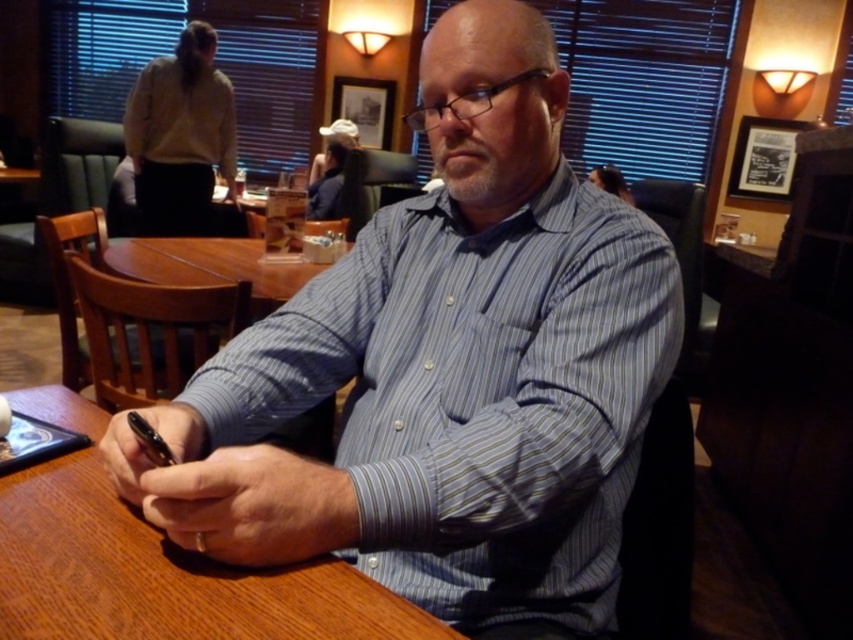
Question: Considering the relative positions of blue striped shirt at center and wooden table at center in the image provided, where is blue striped shirt at center located with respect to wooden table at center?

Choices:
 (A) left
 (B) right

Answer: (B)

Question: Which point is closer to the camera taking this photo?

Choices:
 (A) (480, 12)
 (B) (67, 524)

Answer: (B)

Question: Does blue striped shirt at center lie in front of wooden table at center?

Choices:
 (A) yes
 (B) no

Answer: (B)

Question: Does blue striped shirt at center appear on the left side of wooden table at center?

Choices:
 (A) no
 (B) yes

Answer: (A)

Question: Which point is closer to the camera?

Choices:
 (A) (340, 625)
 (B) (485, 141)

Answer: (A)